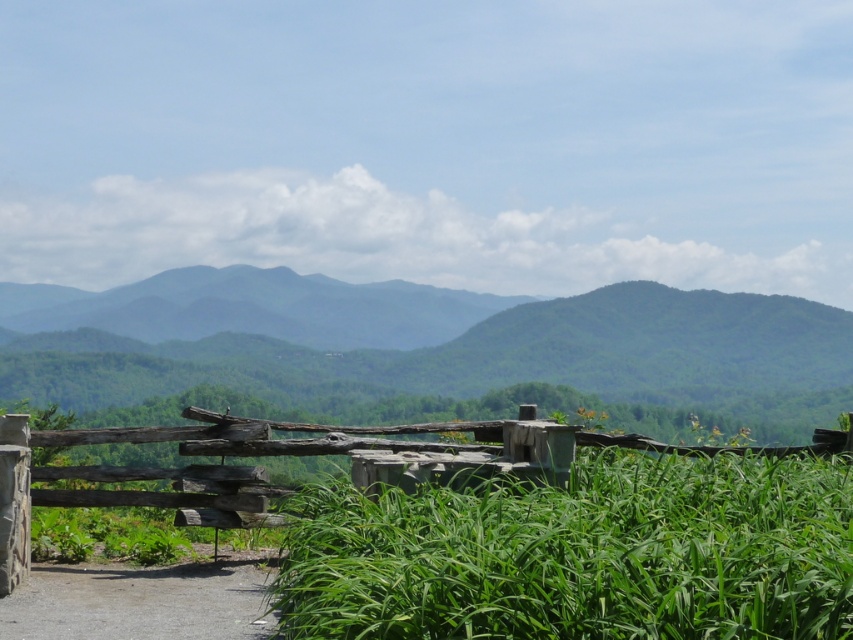
Question: Can you confirm if green textured mountain at center is positioned to the left of dirt/gravel path at lower left?

Choices:
 (A) no
 (B) yes

Answer: (A)

Question: Which of the following is the closest to the observer?

Choices:
 (A) dirt/gravel path at lower left
 (B) green grassy field at center

Answer: (B)

Question: Is green textured mountain at center above dirt/gravel path at lower left?

Choices:
 (A) yes
 (B) no

Answer: (A)

Question: Which object is closer to the camera taking this photo?

Choices:
 (A) dirt/gravel path at lower left
 (B) green textured mountain at center
 (C) green grassy field at center

Answer: (C)

Question: Is green textured mountain at center bigger than dirt/gravel path at lower left?

Choices:
 (A) yes
 (B) no

Answer: (A)

Question: Estimate the real-world distances between objects in this image. Which object is farther from the green grassy field at center?

Choices:
 (A) green textured mountain at center
 (B) dirt/gravel path at lower left

Answer: (A)